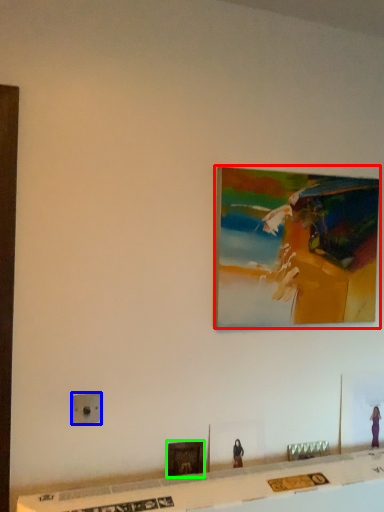
Question: Which object is positioned closest to picture frame (highlighted by a red box)? Select from electric outlet (highlighted by a blue box) and picture frame (highlighted by a green box).

Choices:
 (A) electric outlet
 (B) picture frame

Answer: (B)